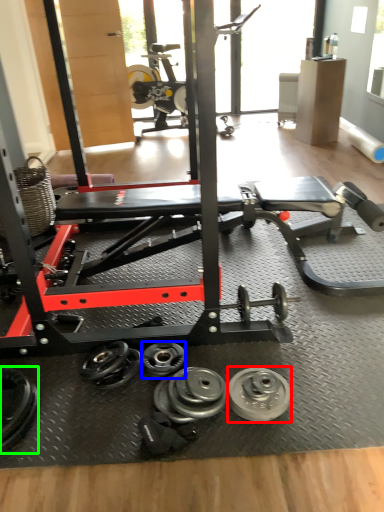
Question: Which is nearer to the wheel (highlighted by a red box)? dumbbell (highlighted by a blue box) or dumbbell (highlighted by a green box).

Choices:
 (A) dumbbell
 (B) dumbbell

Answer: (A)